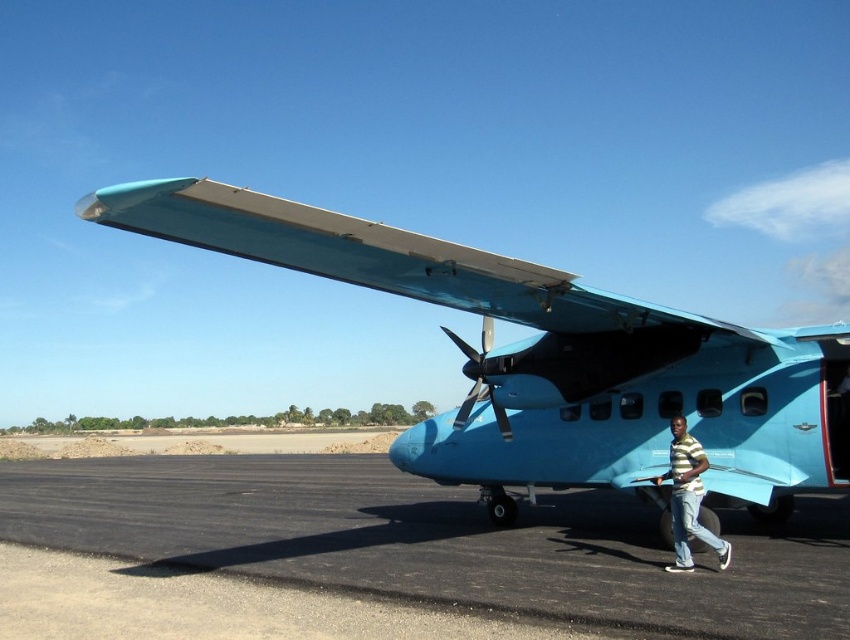
Question: Does black asphalt runway at lower center appear on the right side of metallic silver propeller at center?

Choices:
 (A) yes
 (B) no

Answer: (B)

Question: Which of the following is the farthest from the observer?

Choices:
 (A) striped shirt at lower right
 (B) light blue matte airplane at center

Answer: (A)

Question: Among these objects, which one is farthest from the camera?

Choices:
 (A) light blue matte airplane at center
 (B) striped shirt at lower right
 (C) metallic silver propeller at center

Answer: (C)

Question: Can you confirm if black asphalt runway at lower center is positioned to the left of metallic silver propeller at center?

Choices:
 (A) no
 (B) yes

Answer: (B)

Question: Which object is positioned closest to the black asphalt runway at lower center?

Choices:
 (A) metallic silver propeller at center
 (B) striped shirt at lower right
 (C) light blue matte airplane at center

Answer: (C)

Question: Is black asphalt runway at lower center below metallic silver propeller at center?

Choices:
 (A) yes
 (B) no

Answer: (A)